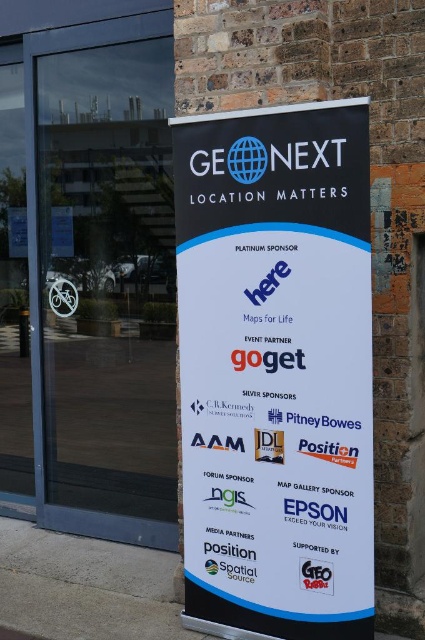
You are standing in front of the promotional banner for GEONEXT. You want to locate the matte red logo at center. Where exactly is it positioned on the banner?

The matte red logo at center is positioned at point 0.900 on the x axis and 0.744 on the y axis.

You are standing in front of the promotional banner for GEONEXT. You notice two points marked on the banner at coordinates point (136, 557) and point (70, 296). From your perspective, which point appears closer to you?

Point (136, 557) is in front of point (70, 296), so it appears closer to you.

You are standing in front of the promotional banner and notice the matte red logo at center and the white plastic bicycle at left. Which object is located below the other?

The matte red logo at center is positioned under the white plastic bicycle at left.